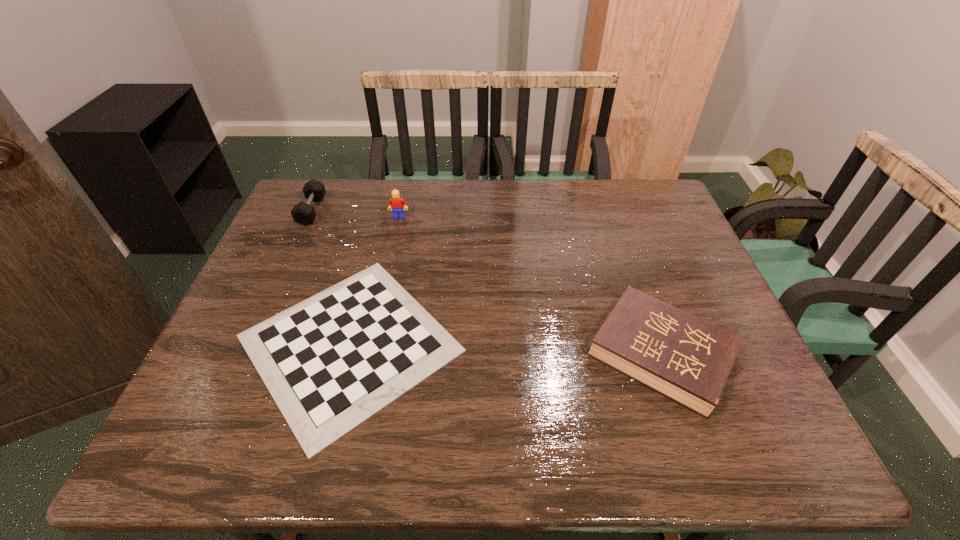
Where is `vacant point at the near edge`? This screenshot has width=960, height=540. vacant point at the near edge is located at coordinates (420, 450).

This screenshot has width=960, height=540. I want to click on vacant space at the left edge, so click(x=263, y=291).

The width and height of the screenshot is (960, 540). Identify the location of vacant space at the right edge of the desktop. 630,224.

In the image, there is a desktop. Where is `vacant space at the far left corner`? vacant space at the far left corner is located at coordinates (331, 207).

In order to click on vacant space at the near left corner of the desktop in this screenshot , I will do `click(176, 449)`.

Locate an element on the screen. Image resolution: width=960 pixels, height=540 pixels. vacant region at the far right corner of the desktop is located at coordinates (636, 184).

The width and height of the screenshot is (960, 540). What are the coordinates of `free space between the tallest object and the rightmost object` in the screenshot? It's located at (530, 286).

This screenshot has height=540, width=960. Find the location of `vacant area that lies between the rightmost object and the tallest object`. vacant area that lies between the rightmost object and the tallest object is located at coordinates (530, 286).

You are a GUI agent. You are given a task and a screenshot of the screen. Output one action in this format:
    pyautogui.click(x=<x>, y=<y>)
    Task: Click on the vacant area that lies between the tallest object and the dumbbell
    The image size is (960, 540).
    Given the screenshot: What is the action you would take?
    pyautogui.click(x=355, y=214)

Identify the location of free point between the hardback book and the chessboard. The image size is (960, 540). (505, 349).